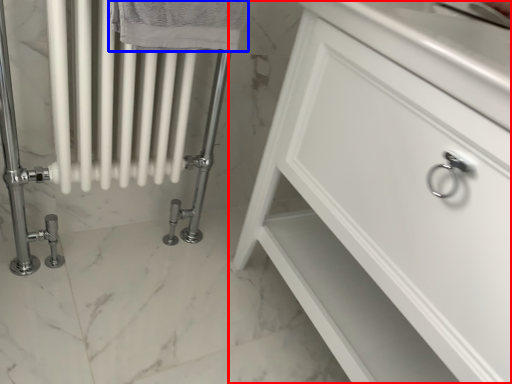
Question: Which point is further to the camera, bathroom cabinet (highlighted by a red box) or bath towel (highlighted by a blue box)?

Choices:
 (A) bathroom cabinet
 (B) bath towel

Answer: (B)